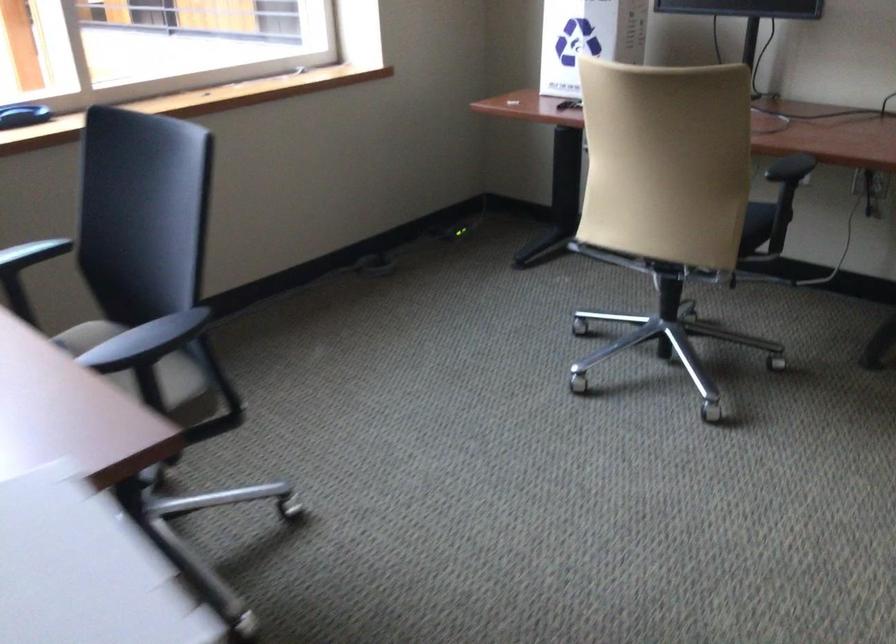
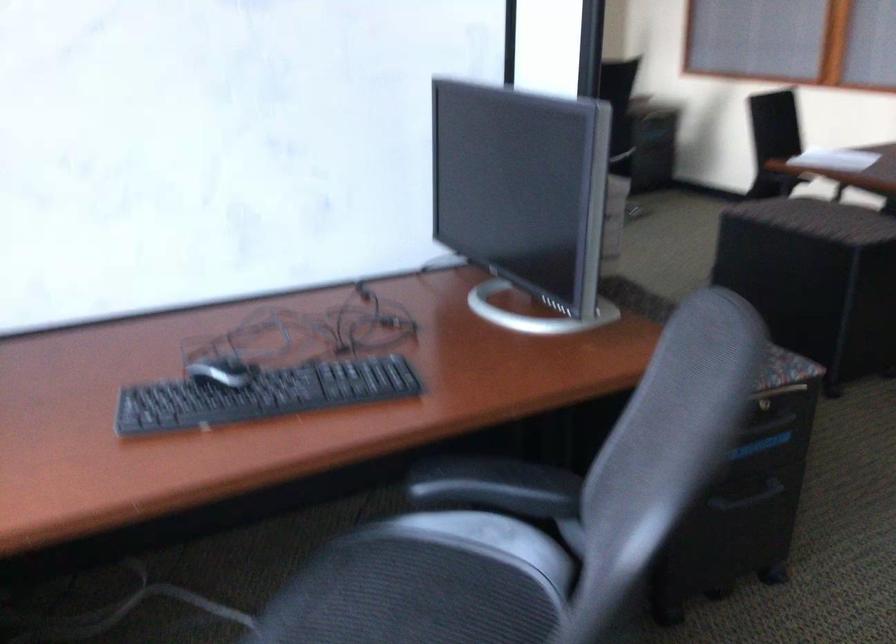
Question: I am providing you with two images of the same scene from different viewpoints. Which of the following objects are not visible in image2?

Choices:
 (A) cabinet drawer handle
 (B) cardboard recycling box
 (C) black chair armrest
 (D) patterned kettle handle

Answer: (B)